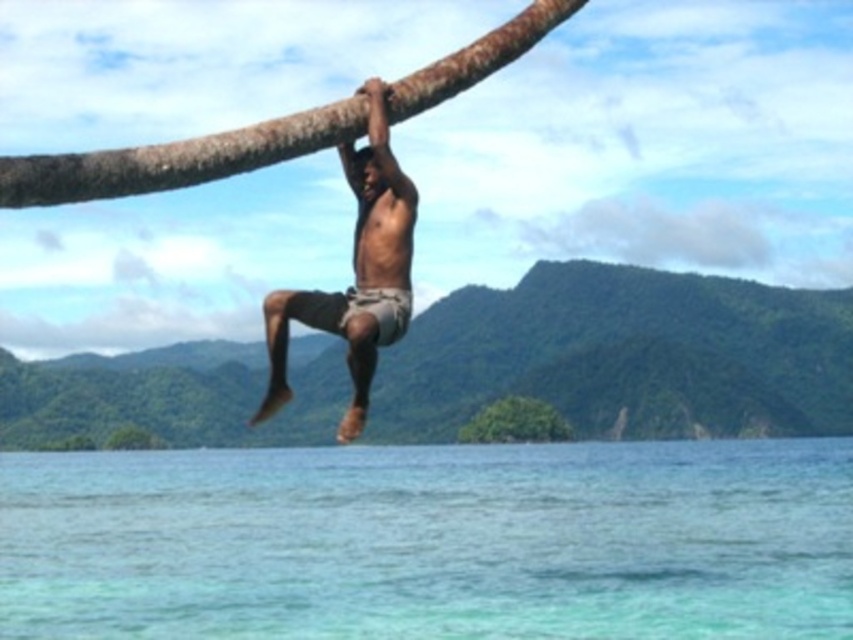
Does clear blue water at lower center appear under brown textured shorts at center?

Indeed, clear blue water at lower center is positioned under brown textured shorts at center.

Describe the element at coordinates (431, 541) in the screenshot. Image resolution: width=853 pixels, height=640 pixels. I see `clear blue water at lower center` at that location.

Is point (6, 508) positioned in front of point (381, 316)?

No, (6, 508) is behind (381, 316).

The width and height of the screenshot is (853, 640). In order to click on clear blue water at lower center in this screenshot , I will do `click(431, 541)`.

Between clear blue water at lower center and green leafy tree at center, which one has more height?

clear blue water at lower center is taller.

What do you see at coordinates (431, 541) in the screenshot?
I see `clear blue water at lower center` at bounding box center [431, 541].

Where is `clear blue water at lower center`? The height and width of the screenshot is (640, 853). clear blue water at lower center is located at coordinates (431, 541).

Is brown textured shorts at center above green leafy tree at center?

Indeed, brown textured shorts at center is positioned over green leafy tree at center.

Between brown textured shorts at center and green leafy tree at center, which one is positioned higher?

brown textured shorts at center is higher up.

Who is more forward, [335,314] or [527,435]?

Point [335,314] is more forward.

Locate an element on the screen. brown textured shorts at center is located at coordinates (355, 273).